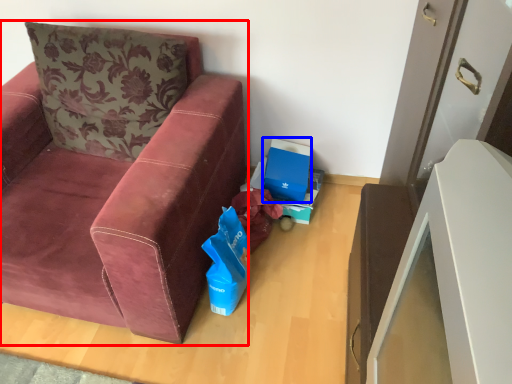
Question: Which object is further to the camera taking this photo, studio couch (highlighted by a red box) or cardboard box (highlighted by a blue box)?

Choices:
 (A) studio couch
 (B) cardboard box

Answer: (B)